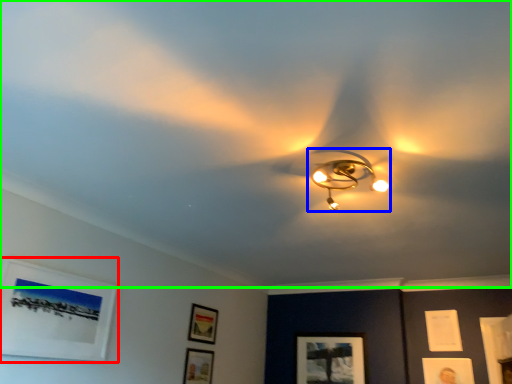
Question: Which object is positioned farthest from picture frame (highlighted by a red box)? Select from lamp (highlighted by a blue box) and fan (highlighted by a green box).

Choices:
 (A) lamp
 (B) fan

Answer: (A)